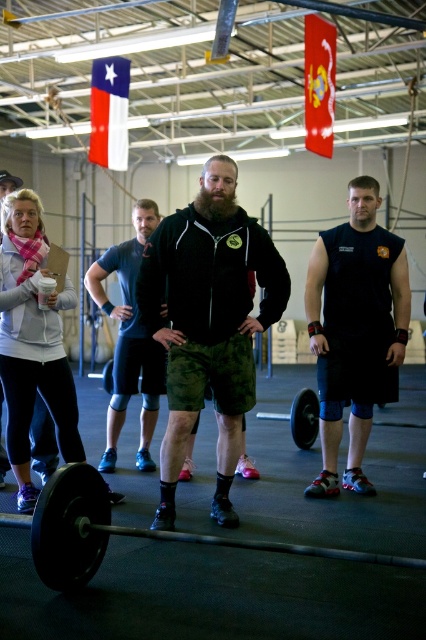
Question: Where is black sleeveless shirt at right located in relation to dark blue fabric shorts at center in the image?

Choices:
 (A) right
 (B) left

Answer: (A)

Question: Which point is closer to the camera?

Choices:
 (A) (164, 256)
 (B) (322, 310)
 (C) (117, 371)
 (D) (20, 490)

Answer: (A)

Question: Is black sleeveless shirt at right smaller than white fleece jacket at upper left?

Choices:
 (A) yes
 (B) no

Answer: (B)

Question: Which of the following is the farthest from the observer?

Choices:
 (A) (x=108, y=259)
 (B) (x=198, y=372)
 (C) (x=71, y=577)

Answer: (A)

Question: Which object appears farthest from the camera in this image?

Choices:
 (A) black sleeveless shirt at right
 (B) camouflage shorts at center

Answer: (A)

Question: Can you confirm if camouflage shorts at center is bigger than black sleeveless shirt at right?

Choices:
 (A) no
 (B) yes

Answer: (A)